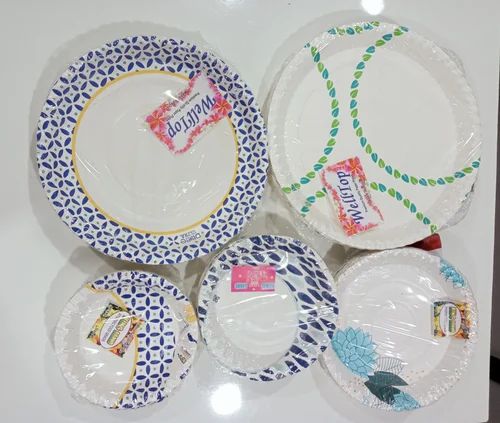
I want to click on plate, so click(x=104, y=324), click(x=248, y=303), click(x=360, y=162), click(x=379, y=301), click(x=114, y=188).